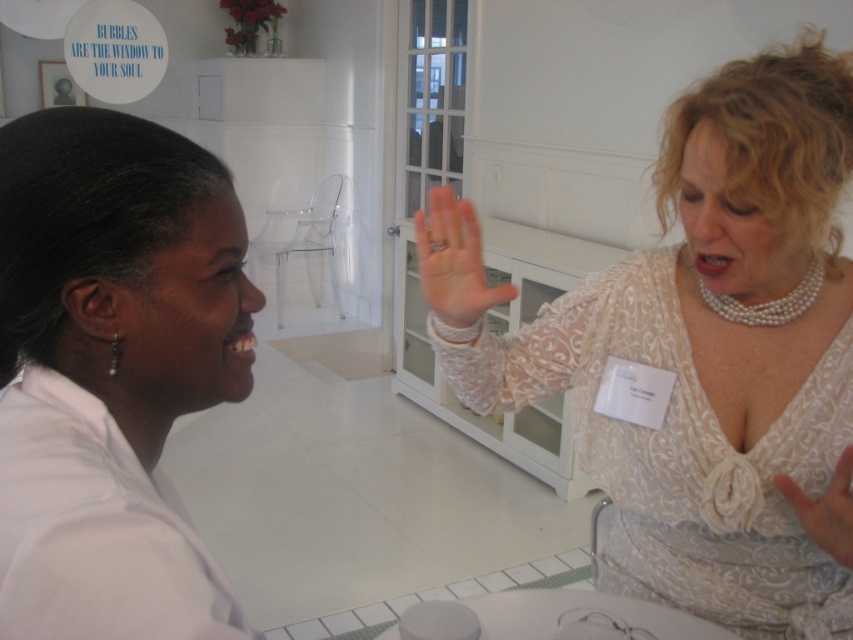
You are a visitor at a medical conference and see the white matte lab coat at left. Where exactly is it located in the image?

The white matte lab coat at left is located at point (107, 371) in the image.

You are a photographer trying to capture a closeup of the white lace dress at upper right without the pearl necklace at upper right blocking the view. Is it possible to do so given their positions?

The white lace dress at upper right is in front of the pearl necklace at upper right, so it would block the view of the pearl necklace. Therefore, it is not possible to capture a closeup of the white lace dress at upper right without the pearl necklace at upper right blocking the view.